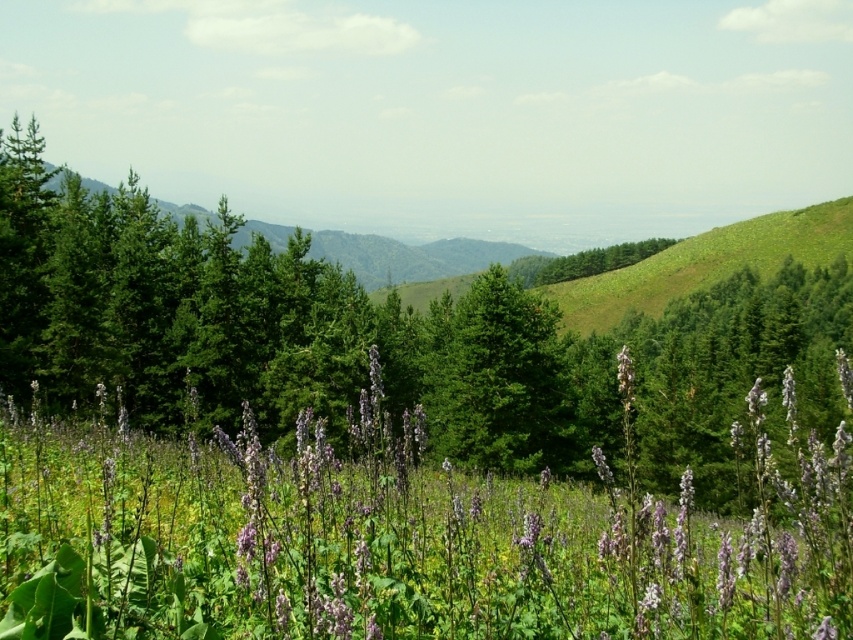
You are an environmental scientist studying the vegetation in this landscape. You observe the green matte tree at center and the green glossy tree at center. Which of these two trees has a larger canopy size?

The green matte tree at center has a larger canopy size than the green glossy tree at center according to the description.

You are standing in the middle of the field of wildflowers and see the green glossy tree at center and the green leafy tree at center. Which tree is closer to the ground?

The green glossy tree at center is located below the green leafy tree at center, so it is closer to the ground.

Based on the photo, you are standing in the middle of the wildflower field and want to walk towards the two points marked in the image. Which point, point (x=445, y=422) or point (x=521, y=444), will you reach first?

You will reach point (x=445, y=422) first because it is closer to you than point (x=521, y=444), which is further away.